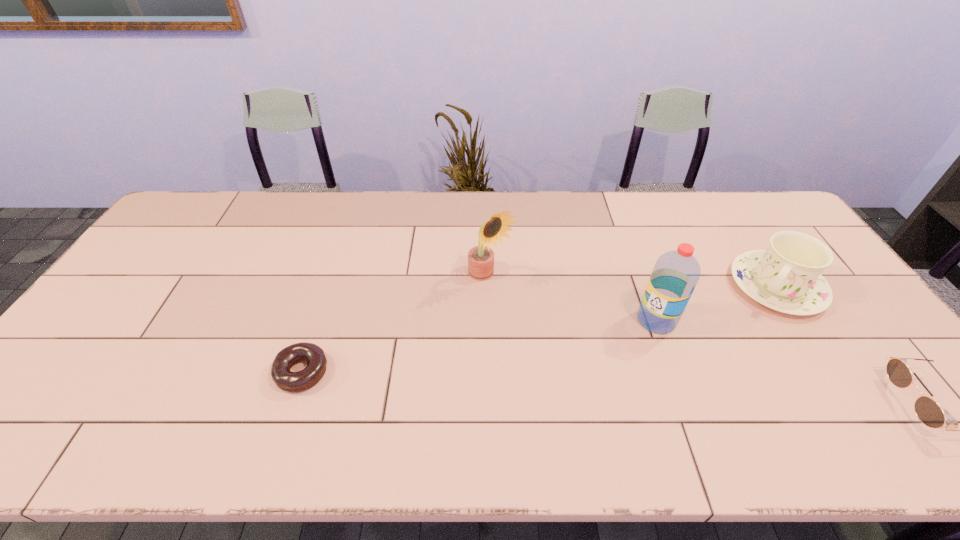
Find the location of a particular element. object that stands as the fourth closest to the second shortest object is located at coordinates (286, 380).

This screenshot has width=960, height=540. I want to click on free space in the image that satisfies the following two spatial constraints: 1. on the back side of the third tallest object; 2. on the left side of the water bottle, so click(x=644, y=287).